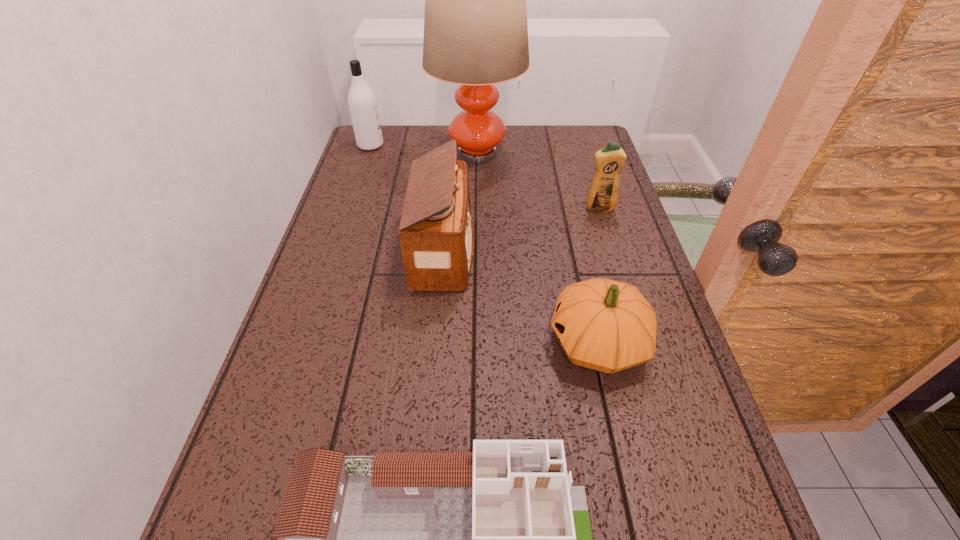
Where is `free space at the left edge`? The image size is (960, 540). free space at the left edge is located at coordinates (375, 275).

This screenshot has width=960, height=540. In the image, there is a desktop. In order to click on free region at the right edge in this screenshot , I will do `click(588, 246)`.

This screenshot has width=960, height=540. In order to click on free spot at the far left corner of the desktop in this screenshot , I will do `click(409, 126)`.

In the image, there is a desktop. Identify the location of free space at the far right corner. Image resolution: width=960 pixels, height=540 pixels. (580, 132).

The image size is (960, 540). Find the location of `vacant space in between the gourd and the third nearest object`. vacant space in between the gourd and the third nearest object is located at coordinates (521, 298).

Identify which object is the second closest to the dollhouse. Please provide its 2D coordinates. Your answer should be formatted as a tuple, i.e. [(x, y)], where the tuple contains the x and y coordinates of a point satisfying the conditions above.

[(436, 236)]

This screenshot has width=960, height=540. Identify the location of object that is the fifth closest to the lamp. (497, 539).

Find the location of a particular element. The width and height of the screenshot is (960, 540). vacant region that satisfies the following two spatial constraints: 1. on the front-facing side of the shampoo; 2. on the right side of the lamp is located at coordinates (368, 153).

Locate an element on the screen. The image size is (960, 540). free space that satisfies the following two spatial constraints: 1. on the label of the detergent; 2. on the front panel of the radio receiver is located at coordinates (612, 252).